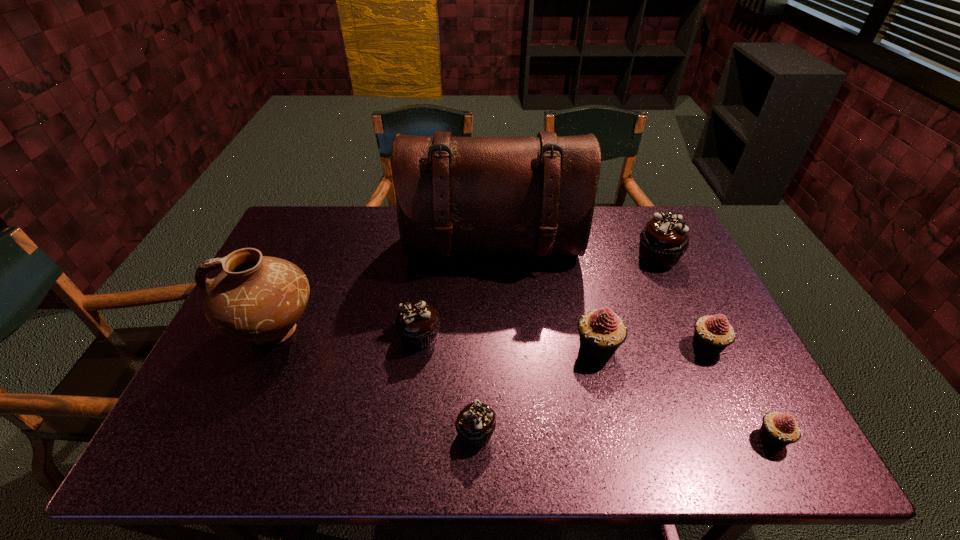
Locate an element on the screen. Image resolution: width=960 pixels, height=540 pixels. empty location between the leftmost object and the biggest brown cupcake is located at coordinates (467, 294).

Where is `vacant area between the smallest pink cupcake and the pottery`? The width and height of the screenshot is (960, 540). vacant area between the smallest pink cupcake and the pottery is located at coordinates (523, 384).

Identify the location of empty space between the second biggest pink cupcake and the leftmost pink cupcake. Image resolution: width=960 pixels, height=540 pixels. (652, 348).

Where is `vacant area that lies between the second smallest brown cupcake and the fourth cupcake from right to left`? vacant area that lies between the second smallest brown cupcake and the fourth cupcake from right to left is located at coordinates (508, 342).

What are the coordinates of `vacant space that is in between the pottery and the biggest brown cupcake` in the screenshot? It's located at (467, 294).

Identify the location of free point between the biggest brown cupcake and the biggest pink cupcake. (627, 303).

Where is `unoccupied area between the nearest pink cupcake and the leftmost pink cupcake`? This screenshot has width=960, height=540. unoccupied area between the nearest pink cupcake and the leftmost pink cupcake is located at coordinates tap(684, 393).

Where is `free space between the second tallest object and the satchel`? This screenshot has width=960, height=540. free space between the second tallest object and the satchel is located at coordinates (384, 290).

Where is `the fourth closest object to the nearest pink cupcake`? Image resolution: width=960 pixels, height=540 pixels. the fourth closest object to the nearest pink cupcake is located at coordinates (470, 195).

Locate an element on the screen. object that is the seventh closest to the leftmost brown cupcake is located at coordinates (778, 430).